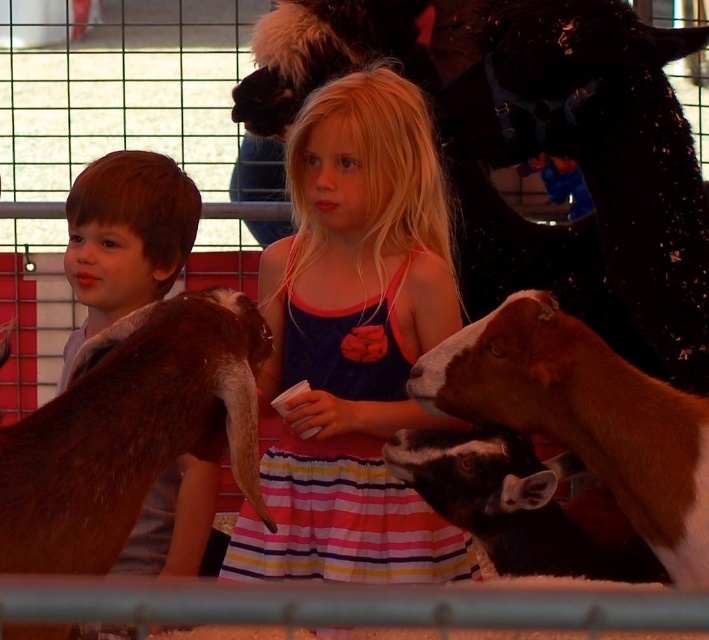
Question: Which point is closer to the camera taking this photo?

Choices:
 (A) (172, 362)
 (B) (502, 330)

Answer: (A)

Question: Can you confirm if matte blue dress at center is positioned below brown fuzzy goat at lower right?

Choices:
 (A) yes
 (B) no

Answer: (B)

Question: Is matte blue dress at center to the right of brown fuzzy goat at lower right from the viewer's perspective?

Choices:
 (A) no
 (B) yes

Answer: (A)

Question: Can you confirm if brown fuzzy goat at lower right is wider than brown fur at left?

Choices:
 (A) no
 (B) yes

Answer: (B)

Question: Which point appears closest to the camera in this image?

Choices:
 (A) (367, 573)
 (B) (640, 513)
 (C) (26, 536)
 (D) (133, 172)

Answer: (C)

Question: Among these points, which one is nearest to the camera?

Choices:
 (A) (563, 339)
 (B) (145, 330)

Answer: (B)